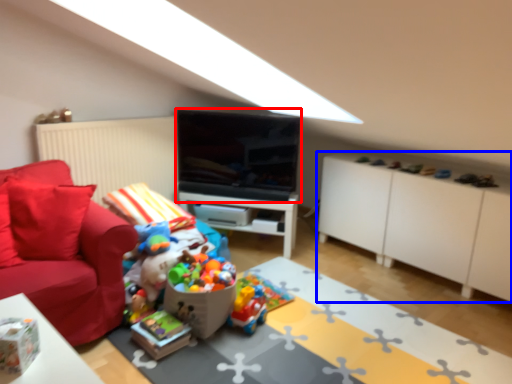
Question: Which object appears closest to the camera in this image, television (highlighted by a red box) or cabinetry (highlighted by a blue box)?

Choices:
 (A) television
 (B) cabinetry

Answer: (B)